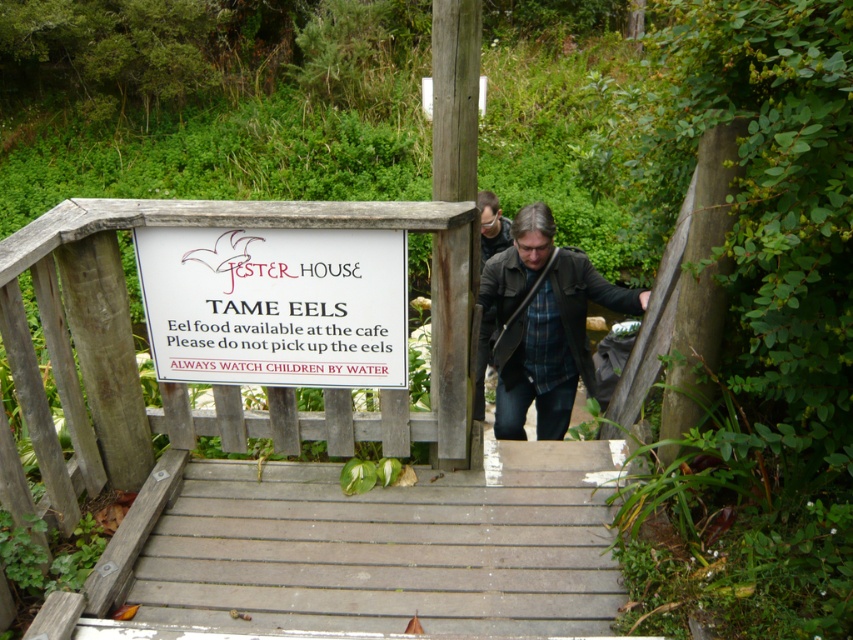
Question: Can you confirm if wooden rail at upper center is thinner than dark brown leather jacket at center?

Choices:
 (A) yes
 (B) no

Answer: (B)

Question: Which point appears farthest from the camera in this image?

Choices:
 (A) (196, 420)
 (B) (582, 333)

Answer: (B)

Question: In this image, where is wooden rail at upper center located relative to white paper sign at upper center?

Choices:
 (A) below
 (B) above

Answer: (A)

Question: Which is nearer to the white paper sign at upper center?

Choices:
 (A) wooden rail at upper center
 (B) dark brown leather jacket at center

Answer: (A)

Question: Which point appears closest to the camera in this image?

Choices:
 (A) (154, 282)
 (B) (508, 424)
 (C) (311, 211)

Answer: (C)

Question: Does wooden rail at upper center have a smaller size compared to white paper sign at upper center?

Choices:
 (A) no
 (B) yes

Answer: (A)